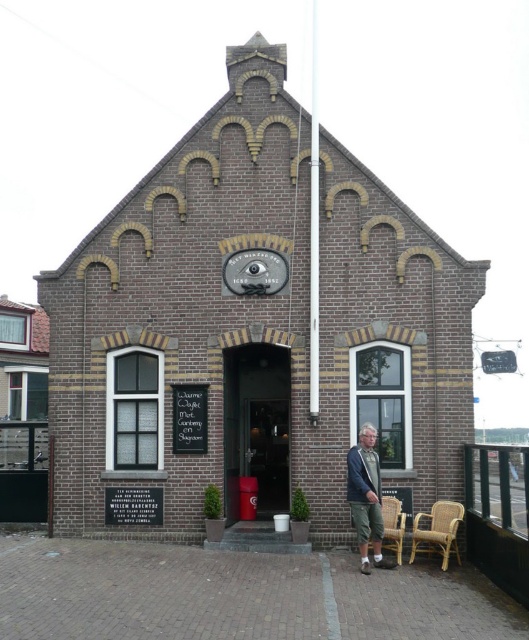
Question: Which object appears closest to the camera in this image?

Choices:
 (A) wicker chair at lower right
 (B) rattan chair at lower right
 (C) denim jacket at lower right

Answer: (C)

Question: Does denim jacket at lower right have a larger size compared to rattan chair at lower right?

Choices:
 (A) yes
 (B) no

Answer: (A)

Question: From the image, what is the correct spatial relationship of rattan chair at lower right in relation to wicker chair at lower right?

Choices:
 (A) above
 (B) below

Answer: (B)

Question: Which point is closer to the camera?

Choices:
 (A) (177, 237)
 (B) (257, 294)
 (C) (458, 506)

Answer: (C)

Question: Based on their relative distances, which object is nearer to the brown brick building at center?

Choices:
 (A) rattan chair at lower right
 (B) wicker chair at lower right
 (C) matte black clock at center
 (D) denim jacket at lower right

Answer: (C)

Question: Does rattan chair at lower right appear on the left side of wicker chair at lower right?

Choices:
 (A) no
 (B) yes

Answer: (A)